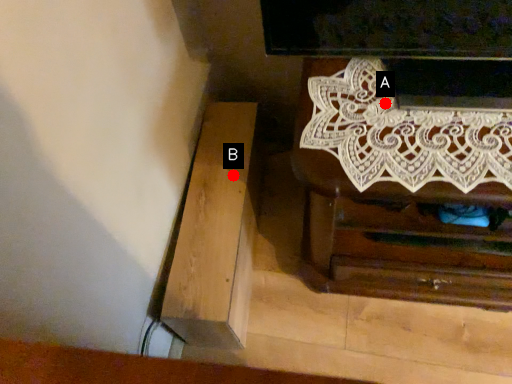
Question: Two points are circled on the image, labeled by A and B beside each circle. Which point is closer to the camera?

Choices:
 (A) A is closer
 (B) B is closer

Answer: (A)